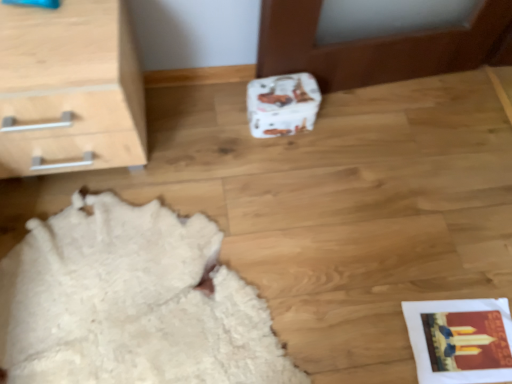
Image resolution: width=512 pixels, height=384 pixels. I want to click on vacant area that lies to the right of white fluffy rug at lower left, so click(x=372, y=240).